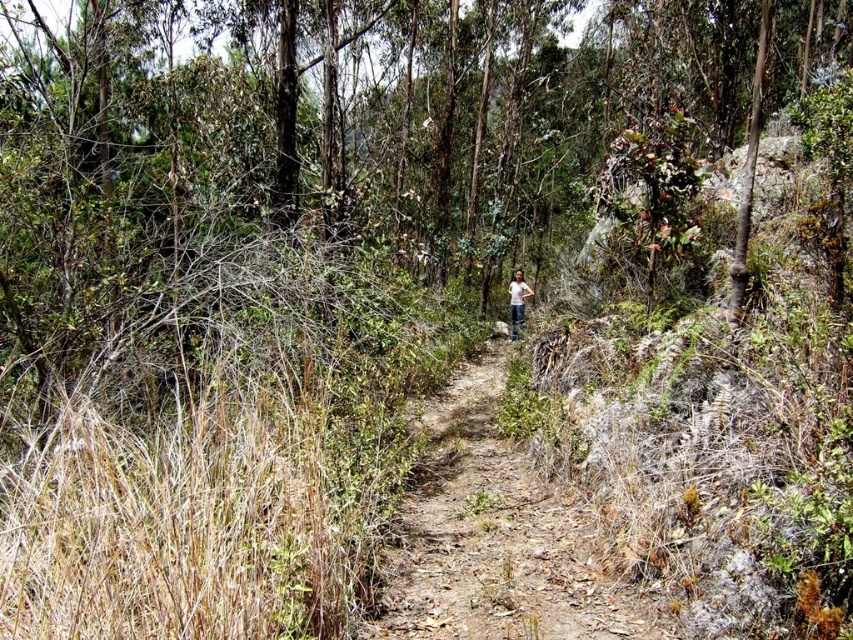
Is dried grass at center smaller than white cotton shirt at center?

No.

Between point (451, 515) and point (519, 272), which one is positioned behind?

The point (519, 272) is more distant.

I want to click on dried grass at center, so click(495, 538).